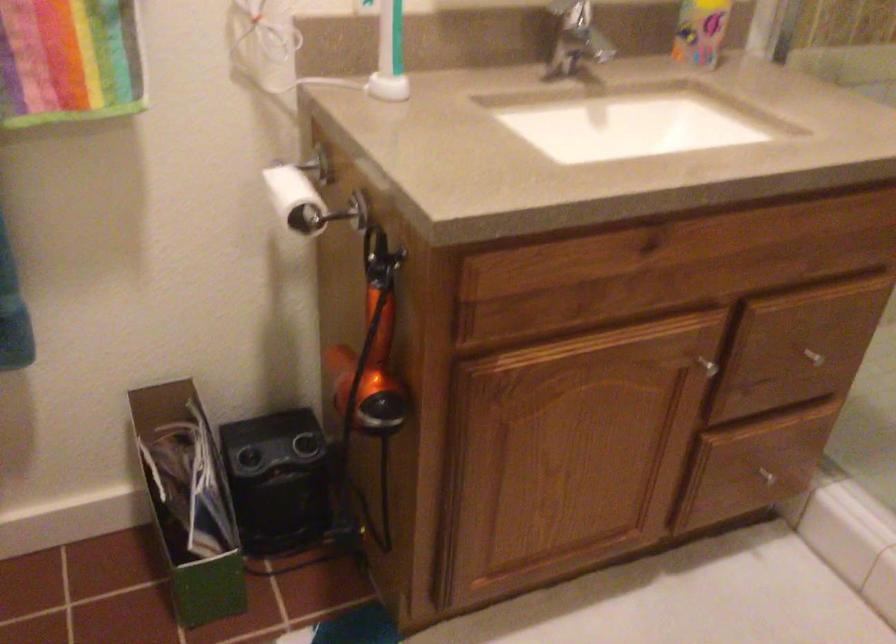
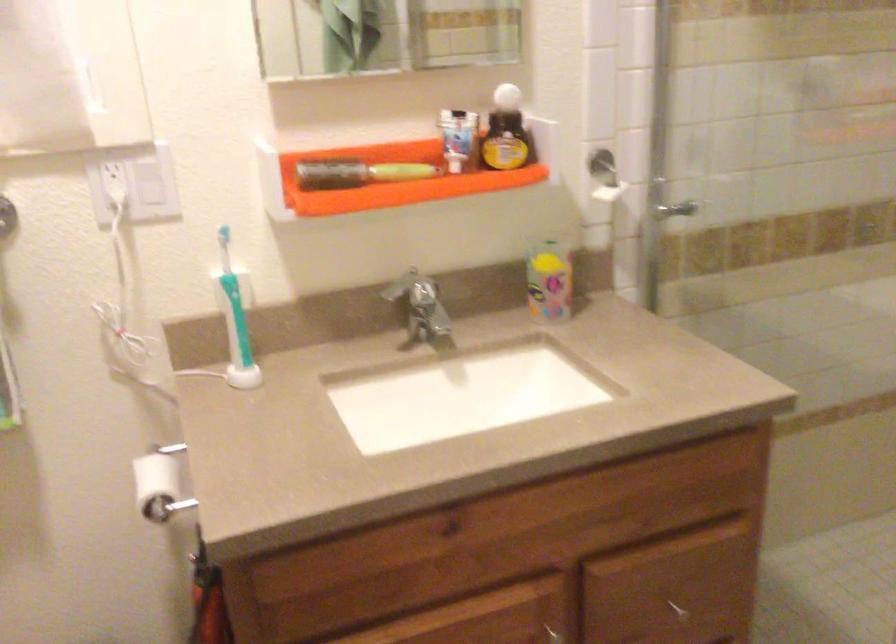
Find the pixel in the second image that matches point (300, 192) in the first image.

(159, 484)